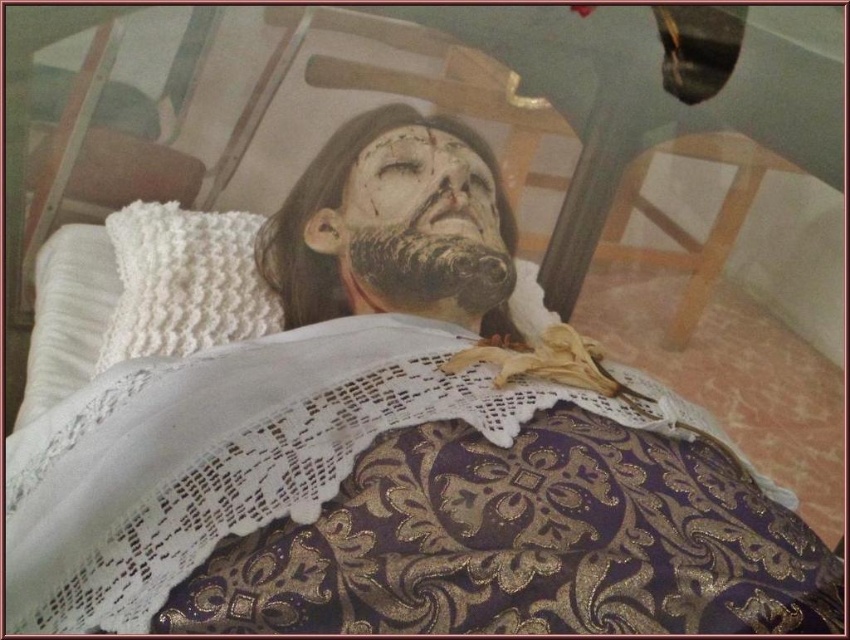
Question: Which point is closer to the camera?

Choices:
 (A) lace fabric at center
 (B) white knitted pillow at upper left

Answer: (A)

Question: Which point is farther to the camera?

Choices:
 (A) pyautogui.click(x=306, y=220)
 (B) pyautogui.click(x=395, y=145)
 (C) pyautogui.click(x=202, y=278)

Answer: (A)

Question: Is matte black face at center to the left of black matte beard at center from the viewer's perspective?

Choices:
 (A) yes
 (B) no

Answer: (B)

Question: Is lace fabric at center bigger than matte black face at center?

Choices:
 (A) yes
 (B) no

Answer: (A)

Question: Observing the image, what is the correct spatial positioning of lace fabric at center in reference to white knitted pillow at upper left?

Choices:
 (A) above
 (B) below

Answer: (B)

Question: Which point is closer to the camera taking this photo?

Choices:
 (A) (128, 268)
 (B) (414, 172)

Answer: (A)